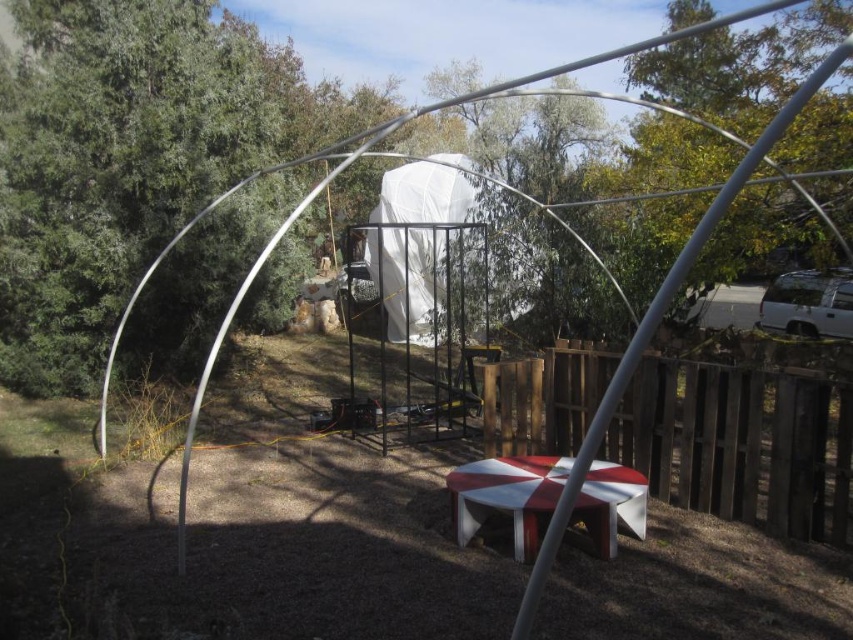
Question: Does wooden at right appear over white fabric tent at center?

Choices:
 (A) yes
 (B) no

Answer: (B)

Question: Which object appears farthest from the camera in this image?

Choices:
 (A) white glossy picnic table at center
 (B) white fabric tent at center
 (C) wooden at right

Answer: (B)

Question: Which object is the farthest from the white fabric tent at center?

Choices:
 (A) white glossy picnic table at center
 (B) wooden at right

Answer: (A)

Question: Does white fabric tent at center have a greater width compared to white glossy picnic table at center?

Choices:
 (A) no
 (B) yes

Answer: (A)

Question: Observing the image, what is the correct spatial positioning of wooden at right in reference to white glossy picnic table at center?

Choices:
 (A) left
 (B) right

Answer: (B)

Question: Estimate the real-world distances between objects in this image. Which object is farther from the white glossy picnic table at center?

Choices:
 (A) white fabric tent at center
 (B) wooden at right

Answer: (A)